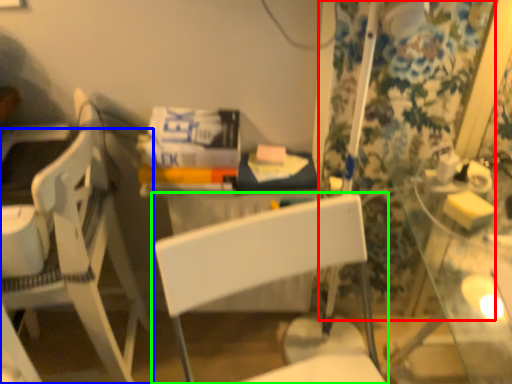
Question: Which object is the farthest from curtain (highlighted by a red box)? Choose among these: chair (highlighted by a blue box) or chair (highlighted by a green box).

Choices:
 (A) chair
 (B) chair

Answer: (A)